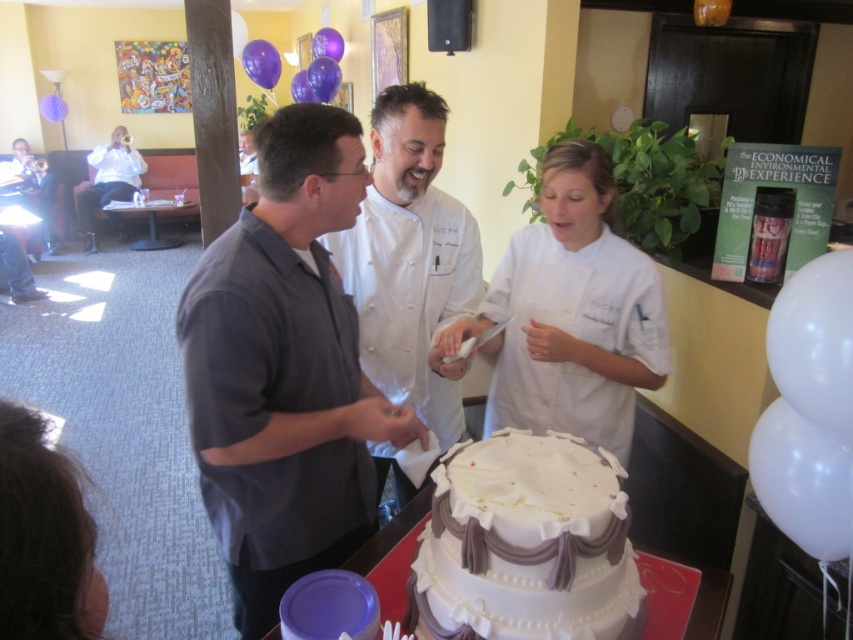
You are at the celebration and want to take a photo of the cake. The photographer tells you to stand at point [274,209] and point [668,362]. Which point is closer to the cake so you can get a better closeup?

Point [274,209] is closer to the camera than point [668,362], so standing there would allow you to get a better closeup of the cake.